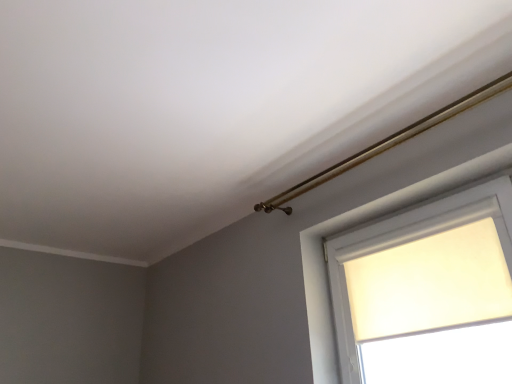
Identify the location of matte white window at upper right. This screenshot has height=384, width=512. (428, 292).

This screenshot has height=384, width=512. What do you see at coordinates (428, 292) in the screenshot? I see `matte white window at upper right` at bounding box center [428, 292].

Find the location of a particular element. matte white window at upper right is located at coordinates (428, 292).